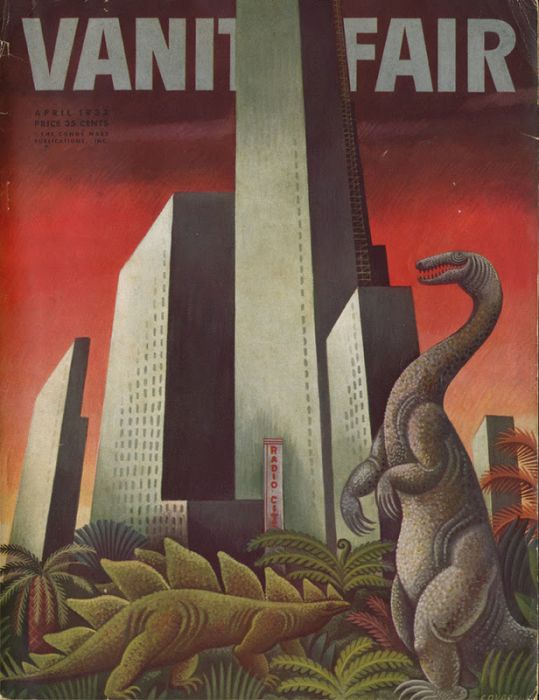
I want to click on light green plant, so tap(357, 673).